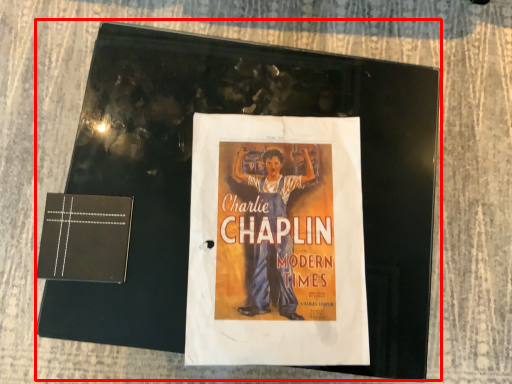
Question: From the image's perspective, where is magazine (annotated by the red box) located in relation to paperback book in the image?

Choices:
 (A) above
 (B) below

Answer: (A)